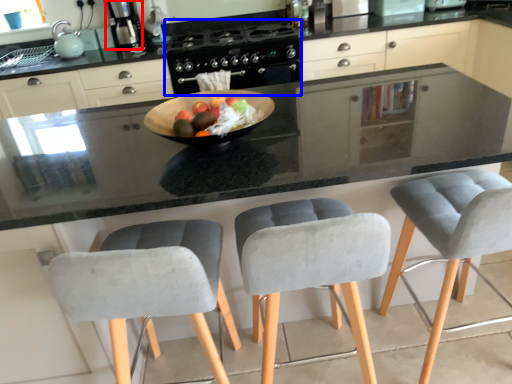
Question: Which object appears closest to the camera in this image, kitchen appliance (highlighted by a red box) or gas stove (highlighted by a blue box)?

Choices:
 (A) kitchen appliance
 (B) gas stove

Answer: (B)